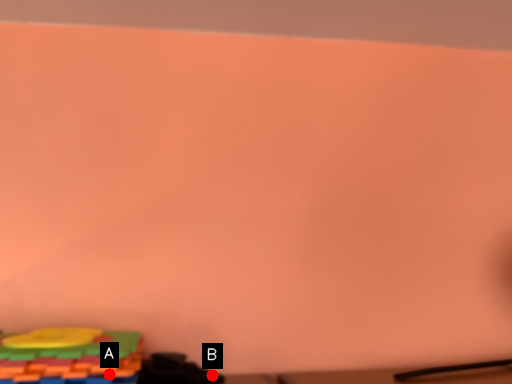
Question: Two points are circled on the image, labeled by A and B beside each circle. Which of the following is the farthest from the observer?

Choices:
 (A) A is further
 (B) B is further

Answer: (B)